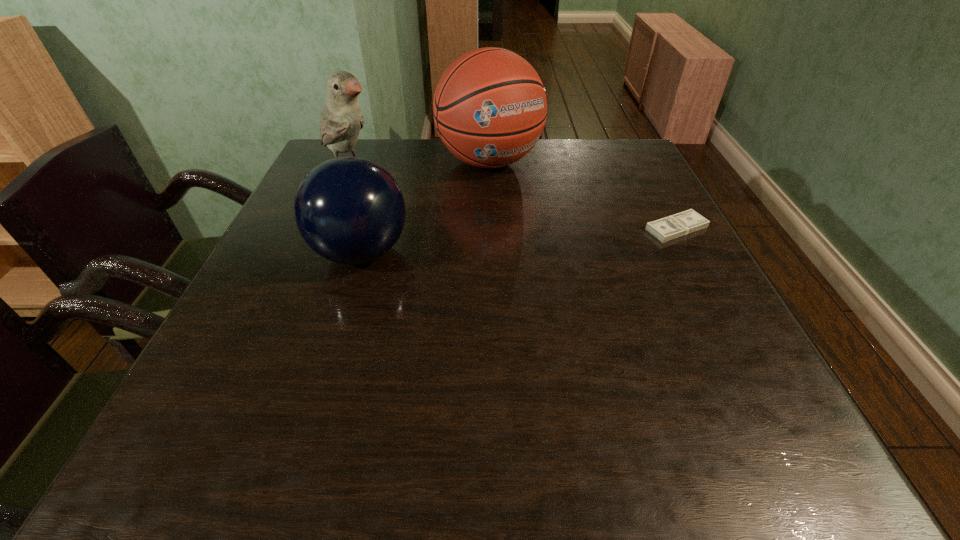
Identify the location of bowling ball. The image size is (960, 540). (349, 210).

At what (x,y) coordinates should I click in order to perform the action: click on the shortest object. Please return your answer as a coordinate pair (x, y). Looking at the image, I should click on (683, 223).

You are a GUI agent. You are given a task and a screenshot of the screen. Output one action in this format:
    pyautogui.click(x=<x>, y=<y>)
    Task: Click on the money
    This screenshot has width=960, height=540.
    Given the screenshot: What is the action you would take?
    pyautogui.click(x=683, y=223)

Where is `the second object from right to left`? Image resolution: width=960 pixels, height=540 pixels. the second object from right to left is located at coordinates (490, 106).

The height and width of the screenshot is (540, 960). In order to click on bird in this screenshot , I will do `click(341, 122)`.

Where is `free spot located on the surface of the bowling ball near the finger holes`? free spot located on the surface of the bowling ball near the finger holes is located at coordinates (276, 253).

Where is `vacant space located on the back of the shortest object`? The height and width of the screenshot is (540, 960). vacant space located on the back of the shortest object is located at coordinates pos(633,146).

You are a GUI agent. You are given a task and a screenshot of the screen. Output one action in this format:
    pyautogui.click(x=<x>, y=<y>)
    Task: Click on the free space located on the logo side of the basketball
    
    Given the screenshot: What is the action you would take?
    pyautogui.click(x=575, y=249)

Where is `vacant space located on the logo side of the basketball`? The image size is (960, 540). vacant space located on the logo side of the basketball is located at coordinates (561, 234).

The width and height of the screenshot is (960, 540). Find the location of `free region located 0.390m on the logo side of the basketball`. free region located 0.390m on the logo side of the basketball is located at coordinates (602, 276).